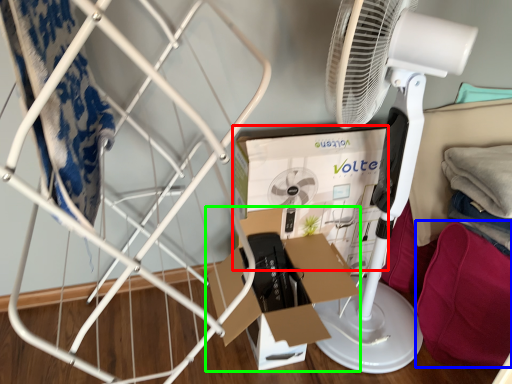
Question: Which object is positioned farthest from box (highlighted by a red box)? Select from clothing (highlighted by a blue box) and cardboard box (highlighted by a green box).

Choices:
 (A) clothing
 (B) cardboard box

Answer: (A)